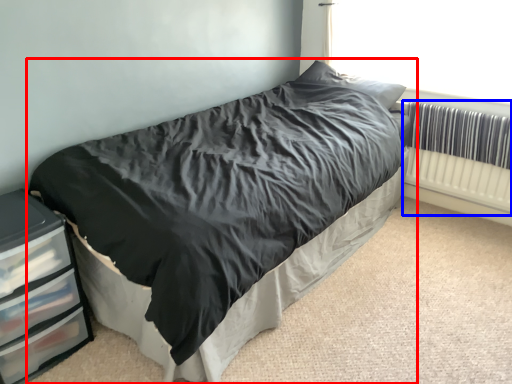
Question: Which of the following is the farthest to the observer, bed (highlighted by a red box) or radiator (highlighted by a blue box)?

Choices:
 (A) bed
 (B) radiator

Answer: (B)